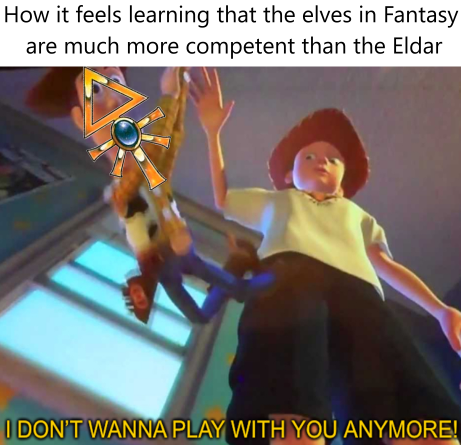
Identify the location of 3 window panes bottom left. The image size is (461, 445). (96, 348), (84, 282), (110, 256).